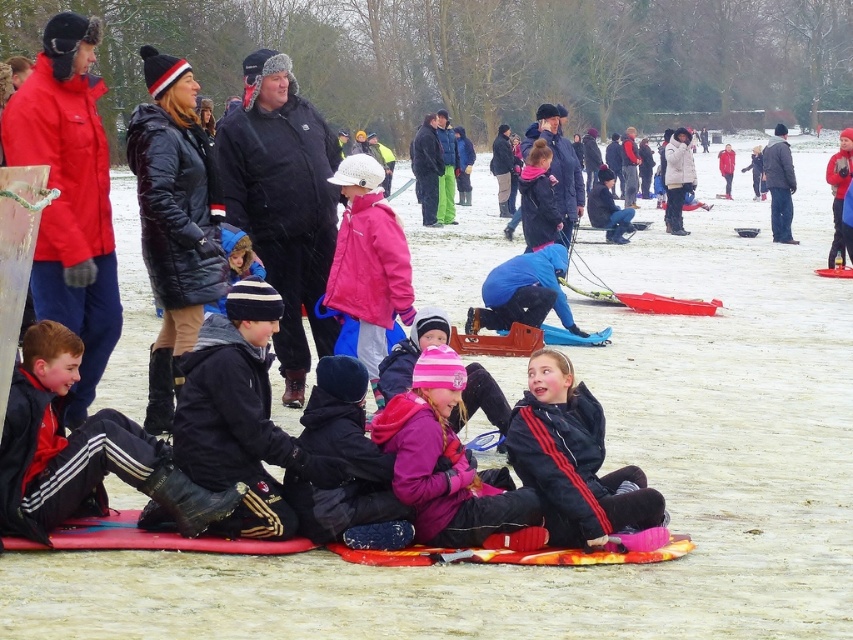
You are a photographer standing in the winter park scene. You need to take a photo that includes both the black leather jacket at lower left and the dark blue fleece jacket at lower center. Which jacket should you adjust your camera angle to focus on first to ensure both are in frame?

The black leather jacket at lower left is taller than the dark blue fleece jacket at lower center. To ensure both are in frame, focus on the taller black leather jacket at lower left first, then adjust to include the shorter dark blue fleece jacket at lower center.

You are a photographer standing in the snowy park scene. You need to capture a photo that includes both the black leather jacket at lower left and the pink fleece jacket at lower center. However, your camera has a limited focus range. Which jacket should you focus on first to ensure both are in frame, considering their heights?

The black leather jacket at lower left is taller than the pink fleece jacket at lower center. To ensure both are in frame, focus on the black leather jacket at lower left first as it requires more space vertically.